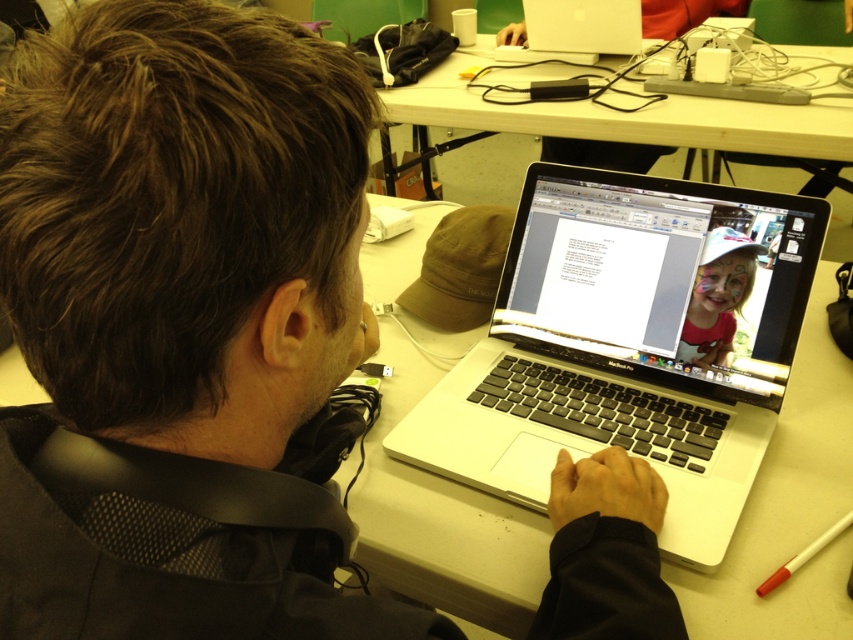
Question: Considering the real-world distances, which object is farthest from the white glossy laptop at upper center?

Choices:
 (A) red plastic pen at lower right
 (B) white plastic table at upper center
 (C) satin silver laptop at center

Answer: (A)

Question: Is silver/black plastic laptop at center below matte plastic girl at center?

Choices:
 (A) no
 (B) yes

Answer: (B)

Question: Is matte plastic girl at center smaller than red plastic pen at lower right?

Choices:
 (A) no
 (B) yes

Answer: (A)

Question: Based on their relative distances, which object is nearer to the satin silver laptop at center?

Choices:
 (A) white plastic table at upper center
 (B) matte plastic girl at center
 (C) red plastic pen at lower right

Answer: (B)

Question: Can you confirm if satin silver laptop at center is positioned above red plastic pen at lower right?

Choices:
 (A) no
 (B) yes

Answer: (B)

Question: Among these points, which one is nearest to the camera?

Choices:
 (A) (718, 298)
 (B) (770, 291)

Answer: (B)